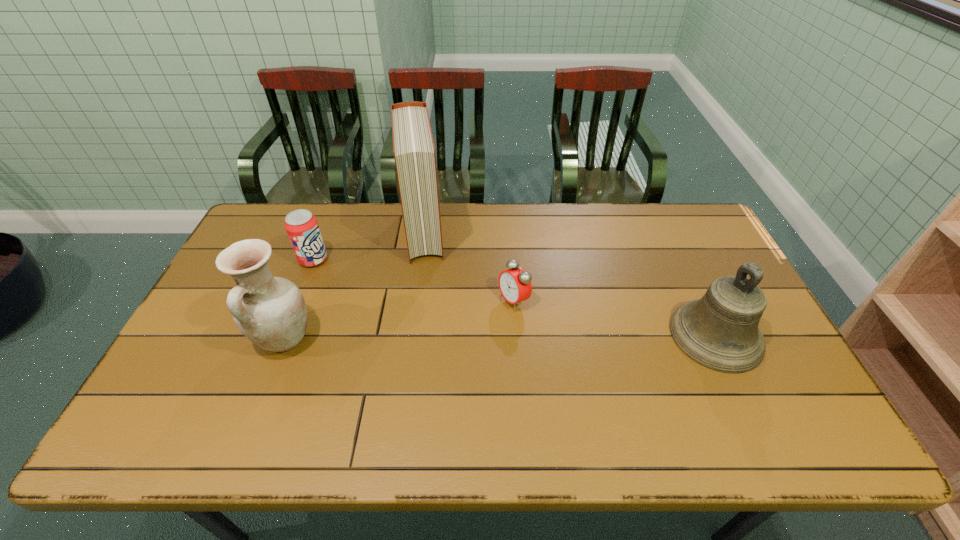
I want to click on vacant space located 0.260m on the surface of the soda can, so point(380,302).

Find the location of a particular element. The width and height of the screenshot is (960, 540). free region located 0.160m on the surface of the soda can is located at coordinates (357, 287).

The image size is (960, 540). Identify the location of free spot located 0.060m on the front-facing side of the shortest object. pyautogui.click(x=484, y=317).

Find the location of `free region located 0.400m on the front-facing side of the shortest object`. free region located 0.400m on the front-facing side of the shortest object is located at coordinates (372, 373).

You are a GUI agent. You are given a task and a screenshot of the screen. Output one action in this format:
    pyautogui.click(x=<x>, y=<y>)
    Task: Click on the vacant space located on the front-facing side of the shortest object
    Image resolution: width=960 pixels, height=540 pixels.
    Given the screenshot: What is the action you would take?
    pyautogui.click(x=468, y=325)

I want to click on free space located 0.170m on the open cover of the third object from left to right, so click(x=428, y=303).

In order to click on free location located on the open cover of the third object from left to right in this screenshot , I will do `click(427, 301)`.

Find the location of `vacant position located on the open cover of the third object from left to right`. vacant position located on the open cover of the third object from left to right is located at coordinates (426, 293).

I want to click on object located in the far edge section of the desktop, so click(413, 146).

The width and height of the screenshot is (960, 540). I want to click on object that is at the right edge, so click(x=720, y=331).